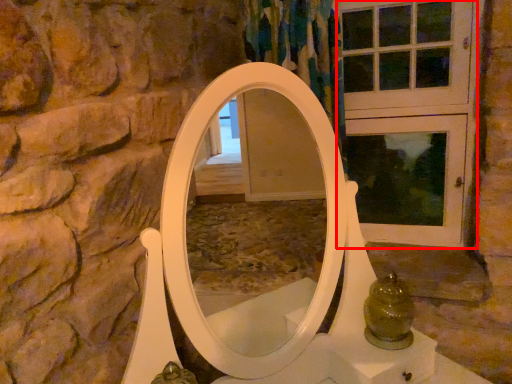
Question: Where is screen door (annotated by the red box) located in relation to glass jar in the image?

Choices:
 (A) left
 (B) right

Answer: (B)